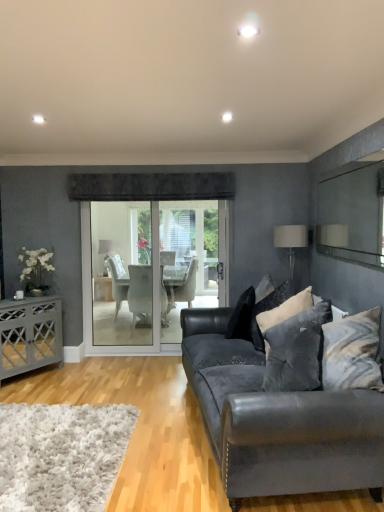
Question: Considering the relative positions of clear glass mirror at upper right and black velvet pillow at center, which ranks as the 4th pillow in front-to-back order, in the image provided, is clear glass mirror at upper right in front of black velvet pillow at center, which ranks as the 4th pillow in front-to-back order,?

Choices:
 (A) yes
 (B) no

Answer: (A)

Question: Considering the relative sizes of clear glass mirror at upper right and black velvet pillow at center, which ranks as the 4th pillow in front-to-back order, in the image provided, is clear glass mirror at upper right wider than black velvet pillow at center, which ranks as the 4th pillow in front-to-back order,?

Choices:
 (A) yes
 (B) no

Answer: (B)

Question: Could you tell me if clear glass mirror at upper right is turned towards black velvet pillow at center, acting as the 1th pillow starting from the back?

Choices:
 (A) no
 (B) yes

Answer: (A)

Question: Considering the relative sizes of clear glass mirror at upper right and black velvet pillow at center, which ranks as the 4th pillow in front-to-back order, in the image provided, is clear glass mirror at upper right thinner than black velvet pillow at center, which ranks as the 4th pillow in front-to-back order,?

Choices:
 (A) no
 (B) yes

Answer: (B)

Question: Is clear glass mirror at upper right not inside black velvet pillow at center, which ranks as the 4th pillow in front-to-back order?

Choices:
 (A) yes
 (B) no

Answer: (A)

Question: Considering the relative sizes of clear glass mirror at upper right and black velvet pillow at center, acting as the 1th pillow starting from the back, in the image provided, is clear glass mirror at upper right bigger than black velvet pillow at center, acting as the 1th pillow starting from the back,?

Choices:
 (A) no
 (B) yes

Answer: (A)

Question: Is matte gray cabinet at left at the right side of black velvet pillow at center, which ranks as the 4th pillow in front-to-back order?

Choices:
 (A) no
 (B) yes

Answer: (A)

Question: Considering the relative sizes of matte gray cabinet at left and black velvet pillow at center, which ranks as the 4th pillow in front-to-back order, in the image provided, is matte gray cabinet at left shorter than black velvet pillow at center, which ranks as the 4th pillow in front-to-back order,?

Choices:
 (A) yes
 (B) no

Answer: (B)

Question: From the image's perspective, is matte gray cabinet at left under black velvet pillow at center, acting as the 1th pillow starting from the back?

Choices:
 (A) no
 (B) yes

Answer: (B)

Question: Is black velvet pillow at center, which ranks as the 4th pillow in front-to-back order, at the back of matte gray cabinet at left?

Choices:
 (A) yes
 (B) no

Answer: (B)

Question: Is the surface of matte gray cabinet at left in direct contact with black velvet pillow at center, which ranks as the 4th pillow in front-to-back order?

Choices:
 (A) no
 (B) yes

Answer: (A)

Question: From the image's perspective, would you say matte gray cabinet at left is positioned over black velvet pillow at center, which ranks as the 4th pillow in front-to-back order?

Choices:
 (A) no
 (B) yes

Answer: (A)

Question: From the image's perspective, is velvet black pillow at center, the 2th pillow viewed from the back, under white silk flower at left?

Choices:
 (A) yes
 (B) no

Answer: (A)